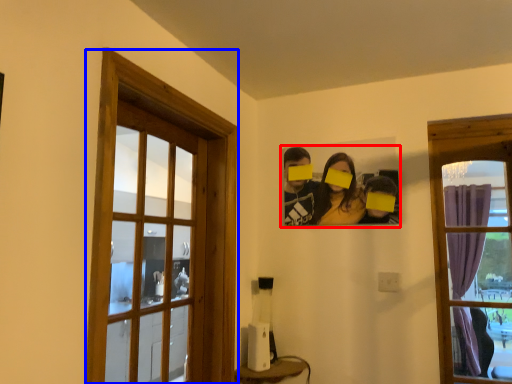
Question: Which object appears farthest to the camera in this image, couple (highlighted by a red box) or window (highlighted by a blue box)?

Choices:
 (A) couple
 (B) window

Answer: (A)